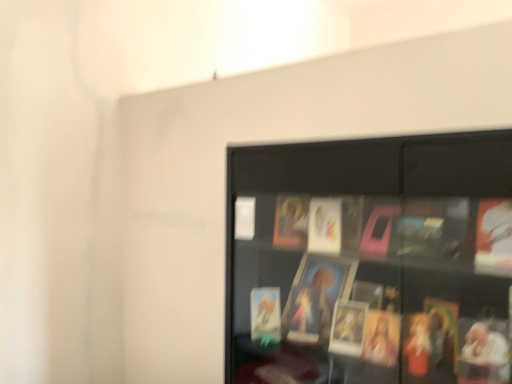
The width and height of the screenshot is (512, 384). I want to click on black glass shelf at upper right, so click(371, 261).

The image size is (512, 384). What do you see at coordinates (371, 261) in the screenshot? I see `black glass shelf at upper right` at bounding box center [371, 261].

I want to click on black glass shelf at upper right, so click(371, 261).